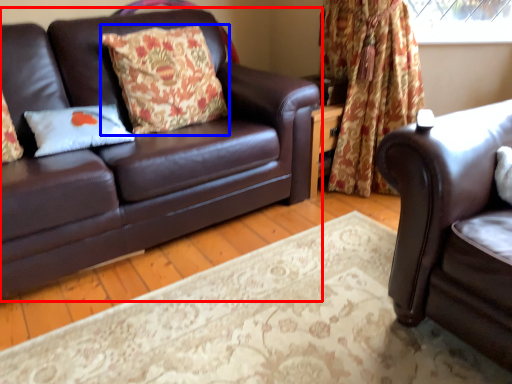
Question: Which object appears farthest to the camera in this image, studio couch (highlighted by a red box) or pillow (highlighted by a blue box)?

Choices:
 (A) studio couch
 (B) pillow

Answer: (B)